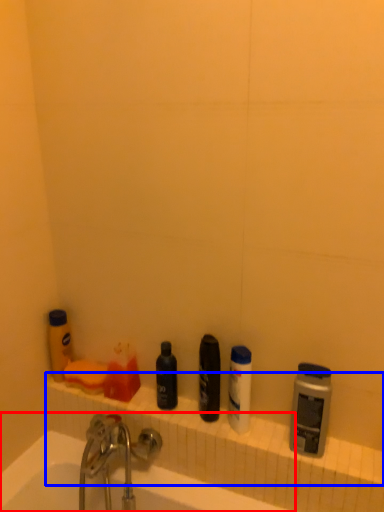
Question: Which object is closer to the camera taking this photo, bathtub (highlighted by a red box) or ledge (highlighted by a blue box)?

Choices:
 (A) bathtub
 (B) ledge

Answer: (A)